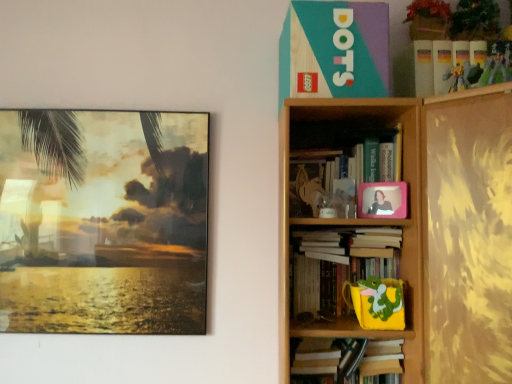
What is the approximate height of hardcover book at upper right, which is the fourth book in top-to-bottom order?

The height of hardcover book at upper right, which is the fourth book in top-to-bottom order, is 7.70 inches.

Describe the element at coordinates (103, 221) in the screenshot. I see `matte glass painting at left, the 2th picture frame positioned from the right` at that location.

Measure the distance between point (9,214) and camera.

Point (9,214) is 5.01 feet away from camera.

Describe the element at coordinates (322, 245) in the screenshot. I see `white paper at center, positioned as the 3th book in top-to-bottom order` at that location.

Find the location of a particular element. The height and width of the screenshot is (384, 512). metallic silver toy at upper right, which appears as the first toy when viewed from the front is located at coordinates (500, 63).

How much space does metallic silver toy at upper right, which is counted as the first toy, starting from the right, occupy horizontally?

metallic silver toy at upper right, which is counted as the first toy, starting from the right, is 1.47 inches in width.

You are a GUI agent. You are given a task and a screenshot of the screen. Output one action in this format:
    pyautogui.click(x=<x>, y=<y>)
    Task: Click on the plastic action figure at upper right, which is the 1th toy from top to bottom
    The height and width of the screenshot is (384, 512).
    Given the screenshot: What is the action you would take?
    pyautogui.click(x=457, y=77)

Between white matte book at upper right, which appears as the 4th book when ordered from the bottom, and pink plastic frame at upper right, the second book in the top-to-bottom sequence, which one has more height?

pink plastic frame at upper right, the second book in the top-to-bottom sequence, is taller.

Is white matte book at upper right, which appears as the 4th book when ordered from the bottom, next to pink plastic frame at upper right, the second book in the top-to-bottom sequence, and touching it?

No, white matte book at upper right, which appears as the 4th book when ordered from the bottom, is not touching pink plastic frame at upper right, the second book in the top-to-bottom sequence.

Between white matte book at upper right, which appears as the 4th book when ordered from the bottom, and pink plastic frame at upper right, the 3th book when ordered from bottom to top, which one is positioned in front?

Positioned in front is pink plastic frame at upper right, the 3th book when ordered from bottom to top.

From a real-world perspective, who is located lower, white matte book at upper right, which appears as the 4th book when ordered from the bottom, or plastic action figure at upper right, which is the 1th toy from top to bottom?

plastic action figure at upper right, which is the 1th toy from top to bottom.

Is point (448, 83) farther from viewer compared to point (459, 77)?

Yes.

Is plastic action figure at upper right, which is the 1th toy from top to bottom, completely or partially inside white matte book at upper right, the 1th book in the top-to-bottom sequence?

No, plastic action figure at upper right, which is the 1th toy from top to bottom, is located outside of white matte book at upper right, the 1th book in the top-to-bottom sequence.

Is wooden bookshelf at upper right positioned behind white matte book at upper right, which appears as the 4th book when ordered from the bottom?

No.

From a real-world perspective, is wooden bookshelf at upper right above or below white matte book at upper right, which appears as the 4th book when ordered from the bottom?

wooden bookshelf at upper right is situated lower than white matte book at upper right, which appears as the 4th book when ordered from the bottom, in the real world.

From the image's perspective, count 3rd books upward from the wooden bookshelf at upper right and point to it. Please provide its 2D coordinates.

[(452, 66)]

Which is correct: wooden bookshelf at upper right is inside white matte book at upper right, the 1th book in the top-to-bottom sequence, or outside of it?

wooden bookshelf at upper right exists outside the volume of white matte book at upper right, the 1th book in the top-to-bottom sequence.

Is wooden bookshelf at upper right at the right side of hardcover book at upper right, the first book when ordered from bottom to top?

In fact, wooden bookshelf at upper right is to the left of hardcover book at upper right, the first book when ordered from bottom to top.

Does wooden bookshelf at upper right lie in front of hardcover book at upper right, the first book when ordered from bottom to top?

That is True.

Is wooden bookshelf at upper right far from hardcover book at upper right, the first book when ordered from bottom to top?

No, wooden bookshelf at upper right is not far from hardcover book at upper right, the first book when ordered from bottom to top.

Is point (485, 293) behind point (375, 307)?

No, it is not.

Is pink plastic frame at upper right, the second book in the top-to-bottom sequence, oriented away from yellow matte cup at lower right, which appears as the 3th toy when viewed from the front?

pink plastic frame at upper right, the second book in the top-to-bottom sequence, does not have its back to yellow matte cup at lower right, which appears as the 3th toy when viewed from the front.

From the image's perspective, which book is the 3rd one above the yellow matte cup at lower right, which appears as the first toy when viewed from the back? Please provide its 2D coordinates.

[(330, 158)]

Between pink plastic frame at upper right, the 3th book when ordered from bottom to top, and yellow matte cup at lower right, which ranks as the third toy in top-to-bottom order, which one appears on the right side from the viewer's perspective?

yellow matte cup at lower right, which ranks as the third toy in top-to-bottom order.

Between point (309, 171) and point (369, 292), which one is positioned behind?

The point (309, 171) is more distant.

From the image's perspective, is matte glass painting at left, the 2th picture frame from the front, beneath pink plastic frame at upper right, the second book in the top-to-bottom sequence?

Indeed, from the image's perspective, matte glass painting at left, the 2th picture frame from the front, is shown beneath pink plastic frame at upper right, the second book in the top-to-bottom sequence.

What's the angular difference between matte glass painting at left, the 2th picture frame from the front, and pink plastic frame at upper right, the second book in the top-to-bottom sequence,'s facing directions?

0.477 degrees separate the facing orientations of matte glass painting at left, the 2th picture frame from the front, and pink plastic frame at upper right, the second book in the top-to-bottom sequence.

Considering the relative sizes of matte glass painting at left, the 2th picture frame positioned from the right, and pink plastic frame at upper right, the second book in the top-to-bottom sequence, in the image provided, is matte glass painting at left, the 2th picture frame positioned from the right, smaller than pink plastic frame at upper right, the second book in the top-to-bottom sequence,?

Yes.

In terms of height, does matte glass painting at left, the 2th picture frame from the front, look taller or shorter compared to pink plastic frame at upper right, the 3th book when ordered from bottom to top?

Clearly, matte glass painting at left, the 2th picture frame from the front, is taller compared to pink plastic frame at upper right, the 3th book when ordered from bottom to top.

Which is behind, point (319, 244) or point (348, 302)?

The point (348, 302) is farther from the camera.

Who is smaller, white paper at center, positioned as the 3th book in top-to-bottom order, or hardcover book at upper right, the first book when ordered from bottom to top?

Smaller between the two is white paper at center, positioned as the 3th book in top-to-bottom order.

From a real-world perspective, is white paper at center, positioned as the 3th book in top-to-bottom order, physically located above or below hardcover book at upper right, which is the fourth book in top-to-bottom order?

white paper at center, positioned as the 3th book in top-to-bottom order, is situated higher than hardcover book at upper right, which is the fourth book in top-to-bottom order, in the real world.

Can you confirm if white paper at center, arranged as the 2th book when ordered from the bottom, is wider than hardcover book at upper right, the first book when ordered from bottom to top?

Yes, white paper at center, arranged as the 2th book when ordered from the bottom, is wider than hardcover book at upper right, the first book when ordered from bottom to top.

At what (x,y) coordinates should I click in order to perform the action: click on book above the pink plastic frame at upper right, the 3th book when ordered from bottom to top (from a real-world perspective). Please return your answer as a coordinate pair (x, y). Looking at the image, I should click on (452, 66).

Identify the location of book on the right side of plastic action figure at upper right, which is the 2th toy from left to right. (452, 66).

Considering their positions, is wooden bookshelf at upper right positioned further to plastic action figure at upper right, arranged as the 3th toy when ordered from the bottom, than pink plastic frame at upper right, the second book in the top-to-bottom sequence?

The object further to plastic action figure at upper right, arranged as the 3th toy when ordered from the bottom, is wooden bookshelf at upper right.

Estimate the real-world distances between objects in this image. Which object is closer to plastic action figure at upper right, which is the 2th toy from left to right, white matte book at upper right, the 1th book in the top-to-bottom sequence, or metallic silver toy at upper right, which is counted as the first toy, starting from the right?

white matte book at upper right, the 1th book in the top-to-bottom sequence, lies closer to plastic action figure at upper right, which is the 2th toy from left to right, than the other object.

Considering their positions, is pink plastic picture frame at upper right, the first picture frame positioned from the right, positioned further to plastic action figure at upper right, the 2th toy when ordered from right to left, than hardcover book at upper right, the first book when ordered from bottom to top?

Among the two, hardcover book at upper right, the first book when ordered from bottom to top, is located further to plastic action figure at upper right, the 2th toy when ordered from right to left.

Estimate the real-world distances between objects in this image. Which object is closer to plastic action figure at upper right, which is the 1th toy from top to bottom, wooden bookshelf at upper right or white paper at center, arranged as the 2th book when ordered from the bottom?

wooden bookshelf at upper right is closer to plastic action figure at upper right, which is the 1th toy from top to bottom.

From the image, which object appears to be nearer to metallic silver toy at upper right, which is counted as the first toy, starting from the right, hardcover book at upper right, the first book when ordered from bottom to top, or wooden bookshelf at upper right?

The object closer to metallic silver toy at upper right, which is counted as the first toy, starting from the right, is wooden bookshelf at upper right.

From the image, which object appears to be nearer to matte glass painting at left, the 2th picture frame from the front, hardcover book at upper right, which is the fourth book in top-to-bottom order, or pink plastic picture frame at upper right, which appears as the second picture frame when viewed from the back?

The object closer to matte glass painting at left, the 2th picture frame from the front, is hardcover book at upper right, which is the fourth book in top-to-bottom order.

Estimate the real-world distances between objects in this image. Which object is closer to white paper at center, arranged as the 2th book when ordered from the bottom, metallic silver toy at upper right, which appears as the third toy when viewed from the left, or white matte book at upper right, the 1th book in the top-to-bottom sequence?

white matte book at upper right, the 1th book in the top-to-bottom sequence, is positioned closer to the anchor white paper at center, arranged as the 2th book when ordered from the bottom.

From the image, which object appears to be farther from white matte book at upper right, the 1th book in the top-to-bottom sequence, pink plastic frame at upper right, the second book in the top-to-bottom sequence, or yellow matte cup at lower right, which appears as the 3th toy when viewed from the front?

The object further to white matte book at upper right, the 1th book in the top-to-bottom sequence, is yellow matte cup at lower right, which appears as the 3th toy when viewed from the front.

Image resolution: width=512 pixels, height=384 pixels. I want to click on picture frame between white matte book at upper right, which appears as the 4th book when ordered from the bottom, and white paper at center, arranged as the 2th book when ordered from the bottom, in the up-down direction, so click(x=382, y=200).

Where is `toy that lies between plastic action figure at upper right, placed as the 2th toy when sorted from back to front, and pink plastic picture frame at upper right, arranged as the second picture frame when viewed from the left, from top to bottom`? toy that lies between plastic action figure at upper right, placed as the 2th toy when sorted from back to front, and pink plastic picture frame at upper right, arranged as the second picture frame when viewed from the left, from top to bottom is located at coordinates (500, 63).

Identify the location of picture frame between metallic silver toy at upper right, which ranks as the second toy in top-to-bottom order, and white paper at center, arranged as the 2th book when ordered from the bottom, from top to bottom. Image resolution: width=512 pixels, height=384 pixels. (382, 200).

Where is `toy between matte glass painting at left, the first picture frame from the left, and pink plastic picture frame at upper right, arranged as the second picture frame when viewed from the left, from left to right`? The width and height of the screenshot is (512, 384). toy between matte glass painting at left, the first picture frame from the left, and pink plastic picture frame at upper right, arranged as the second picture frame when viewed from the left, from left to right is located at coordinates (377, 303).